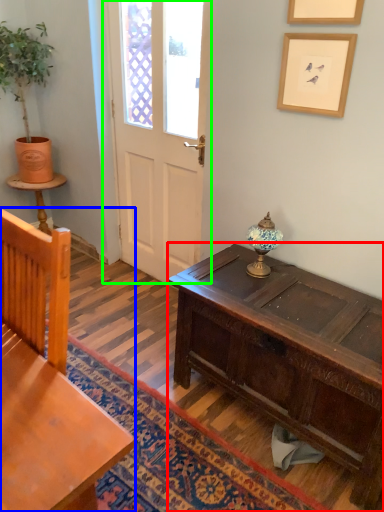
Question: Which object is the farthest from desk (highlighted by a red box)? Choose among these: chair (highlighted by a blue box) or door (highlighted by a green box).

Choices:
 (A) chair
 (B) door

Answer: (B)